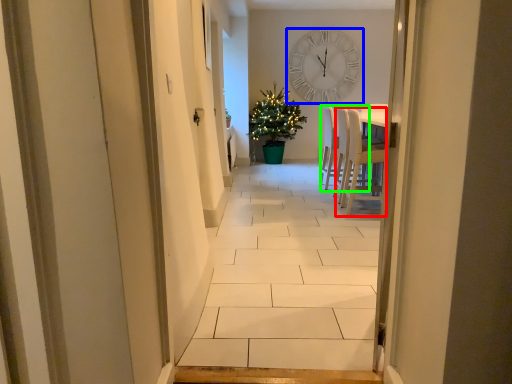
Question: Which object is the closest to the chair (highlighted by a red box)? Choose among these: wall clock (highlighted by a blue box) or armchair (highlighted by a green box).

Choices:
 (A) wall clock
 (B) armchair

Answer: (B)